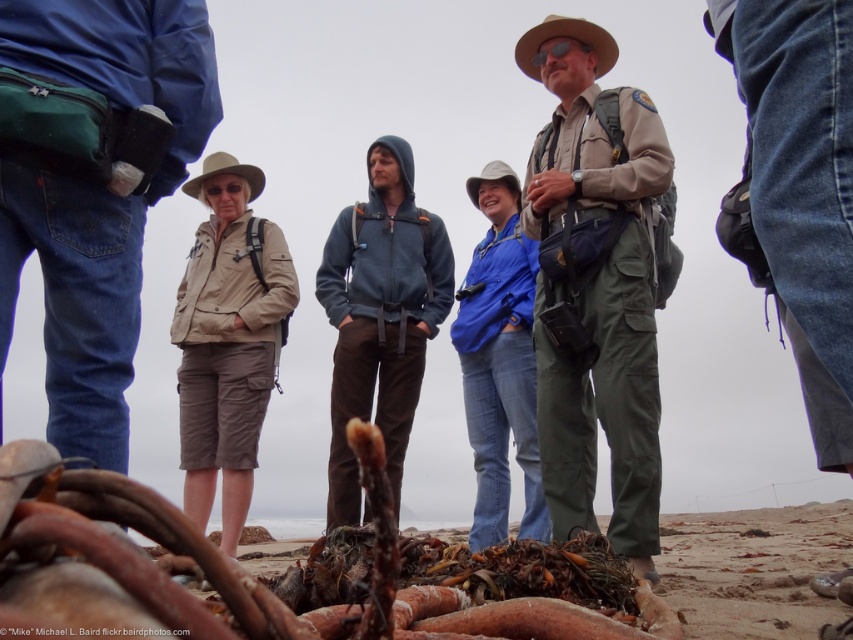
Question: Which object is farther from the camera taking this photo?

Choices:
 (A) matte khaki cowboy hat at center
 (B) blue denim jeans at center
 (C) matte blue hoodie at center
 (D) brown fabric cowboy hat at upper center

Answer: (A)

Question: Based on their relative distances, which object is nearer to the khaki uniform at center?

Choices:
 (A) blue denim jeans at center
 (B) tan fabric jacket at center
 (C) matte blue hoodie at center
 (D) white fabric cowboy hat at center

Answer: (A)

Question: Can you confirm if brown organic debris at lower center is positioned above blue denim jeans at center?

Choices:
 (A) no
 (B) yes

Answer: (A)

Question: Which point is farther to the camera?

Choices:
 (A) khaki uniform at center
 (B) blue denim jeans at center
 (C) brown fabric cowboy hat at upper center

Answer: (B)

Question: Does matte blue hoodie at center appear on the left side of matte khaki cowboy hat at center?

Choices:
 (A) no
 (B) yes

Answer: (A)

Question: Does blue denim jeans at center have a larger size compared to white fabric cowboy hat at center?

Choices:
 (A) yes
 (B) no

Answer: (A)